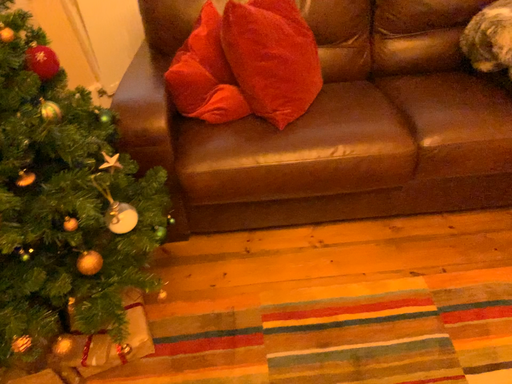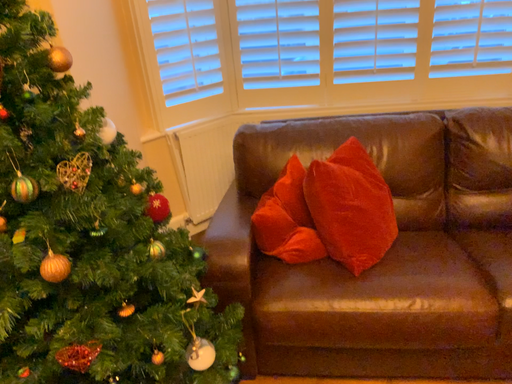
Question: Which way did the camera rotate in the video?

Choices:
 (A) rotated left
 (B) rotated right

Answer: (A)